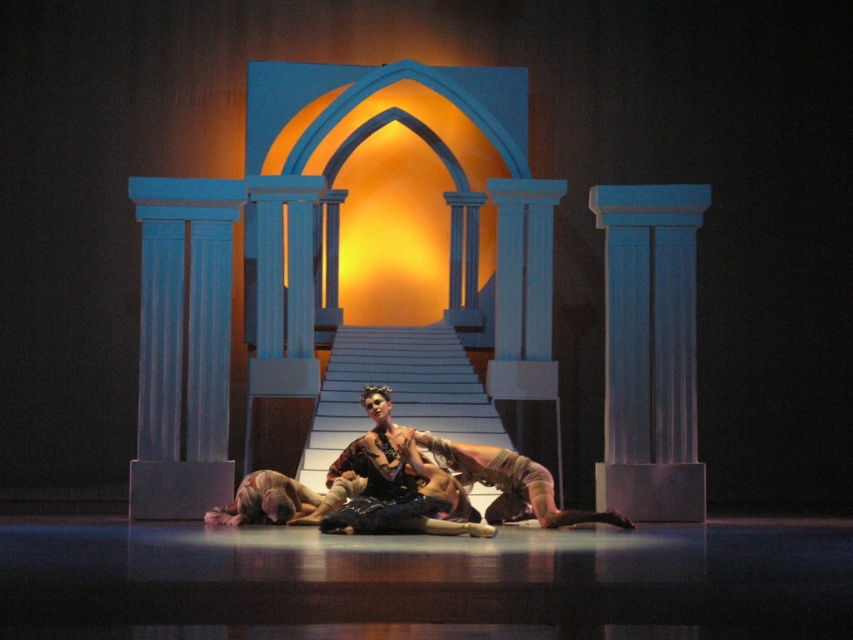
Is shiny black dress at center to the left of tan leather pants at center from the viewer's perspective?

Indeed, shiny black dress at center is positioned on the left side of tan leather pants at center.

Which is in front, point (399, 445) or point (566, 524)?

Positioned in front is point (399, 445).

Does point (347, 449) lie in front of point (465, 460)?

That is True.

Find the location of `shiny black dress at center`. shiny black dress at center is located at coordinates (397, 483).